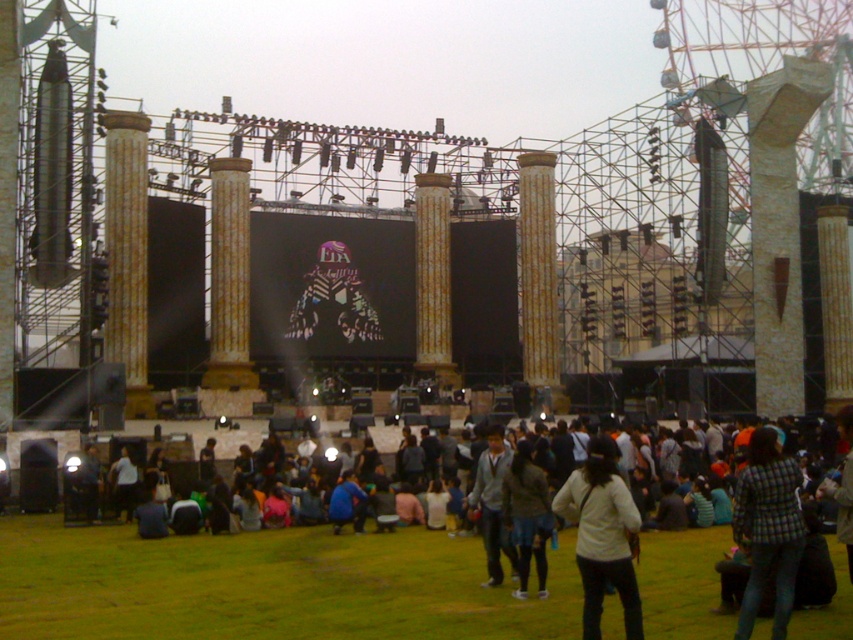
You are a photographer at the concert and want to capture both the white casual clothing at center and the dark gray fabric jacket at center in a single photo. Which of the two clothing items will appear larger in the photo?

The white casual clothing at center will appear larger in the photo because it is bigger than the dark gray fabric jacket at center.

You are a photographer at the concert and want to capture both the white casual clothing at center and the plaid fabric jacket at lower right in a single shot. Which of the two objects should you focus on first if you want to ensure both are in focus?

You should focus on the plaid fabric jacket at lower right first because it is taller than the white casual clothing at center, so focusing on the farther object first will help ensure both are in focus.